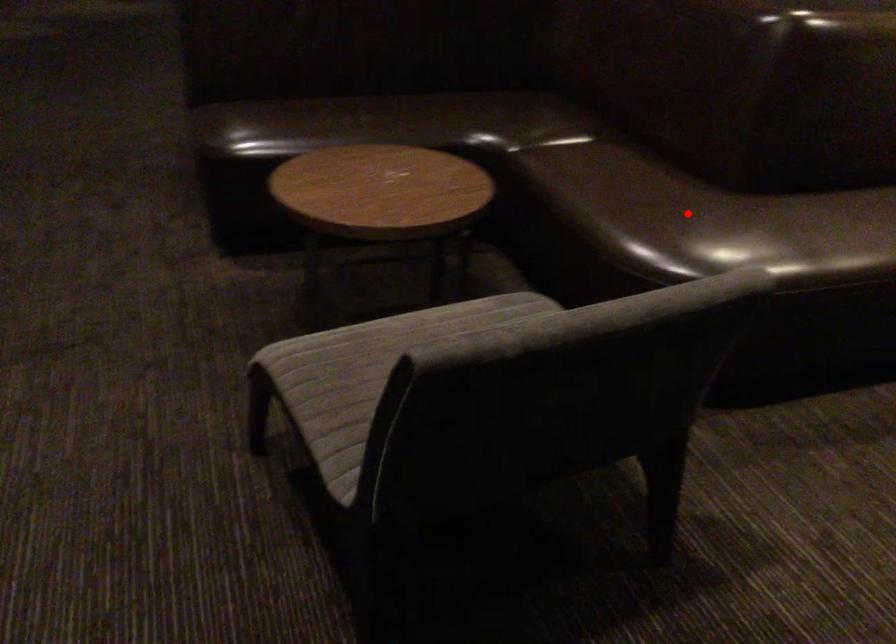
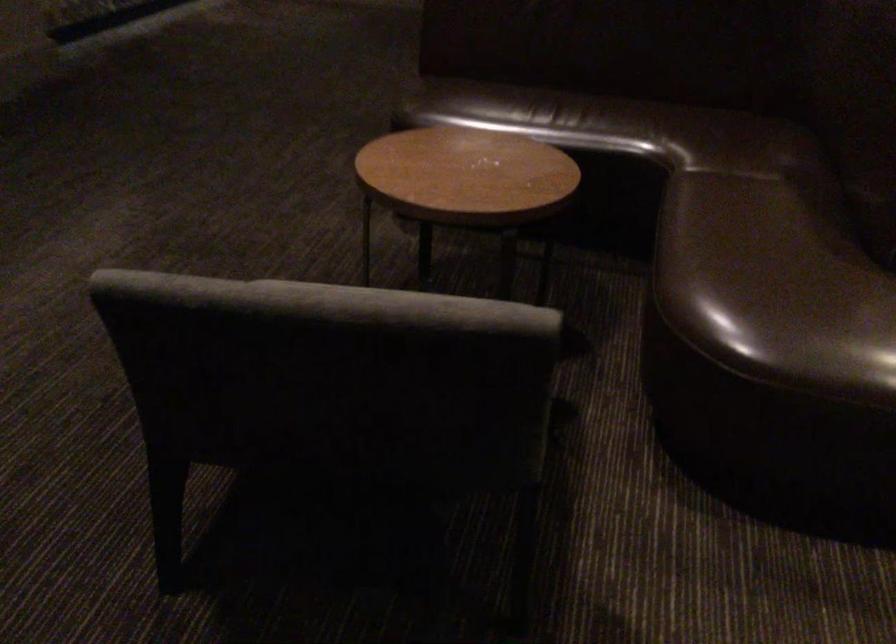
Question: I am providing you with two images of the same scene from different viewpoints. In image1, a red point is highlighted. Considering the same 3D point in image2, which of the following is correct?

Choices:
 (A) It is closer
 (B) It is farther

Answer: (A)